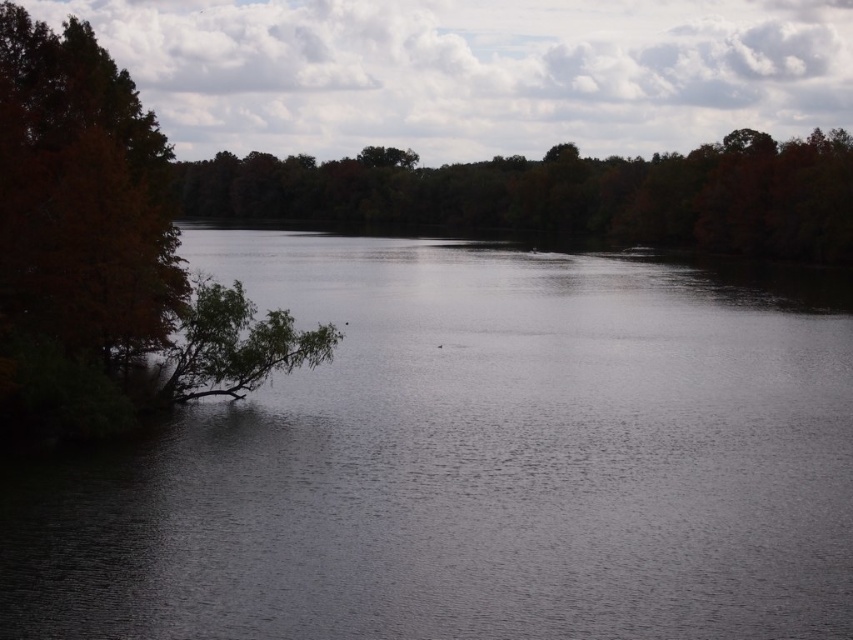
The image size is (853, 640). Describe the element at coordinates (471, 460) in the screenshot. I see `dark water at center` at that location.

The height and width of the screenshot is (640, 853). Find the location of `dark water at center`. dark water at center is located at coordinates (471, 460).